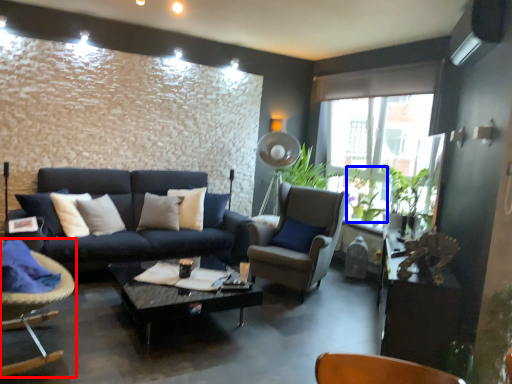
Question: Which point is further to the camera, chair (highlighted by a red box) or plant (highlighted by a blue box)?

Choices:
 (A) chair
 (B) plant

Answer: (B)